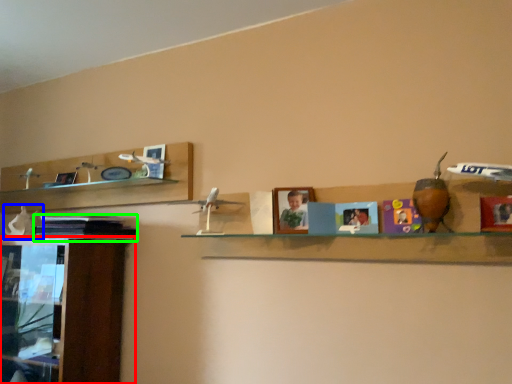
Question: Which object is the farthest from cabinetry (highlighted by a red box)? Choose among these: toy (highlighted by a blue box) or book (highlighted by a green box).

Choices:
 (A) toy
 (B) book

Answer: (A)